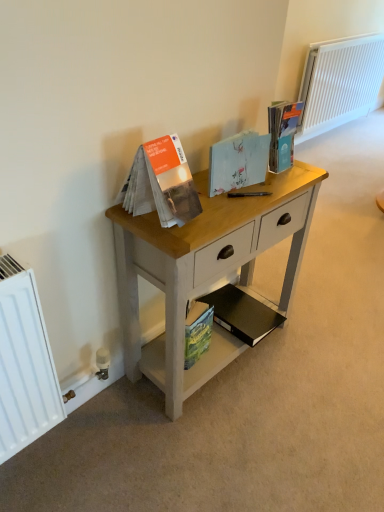
You are a GUI agent. You are given a task and a screenshot of the screen. Output one action in this format:
    pyautogui.click(x=<x>, y=<y>)
    Task: Click on the vacant space in front of light wood desk at center
    
    Given the screenshot: What is the action you would take?
    pyautogui.click(x=217, y=443)